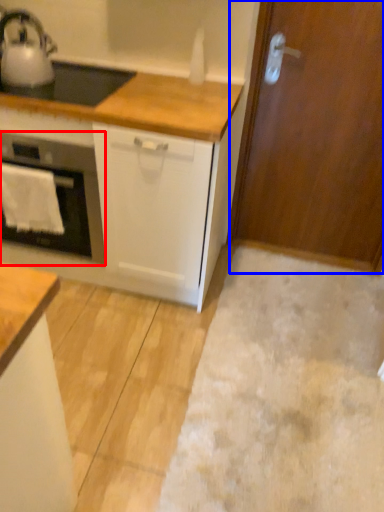
Question: Which of the following is the closest to the observer, home appliance (highlighted by a red box) or door (highlighted by a blue box)?

Choices:
 (A) home appliance
 (B) door

Answer: (A)